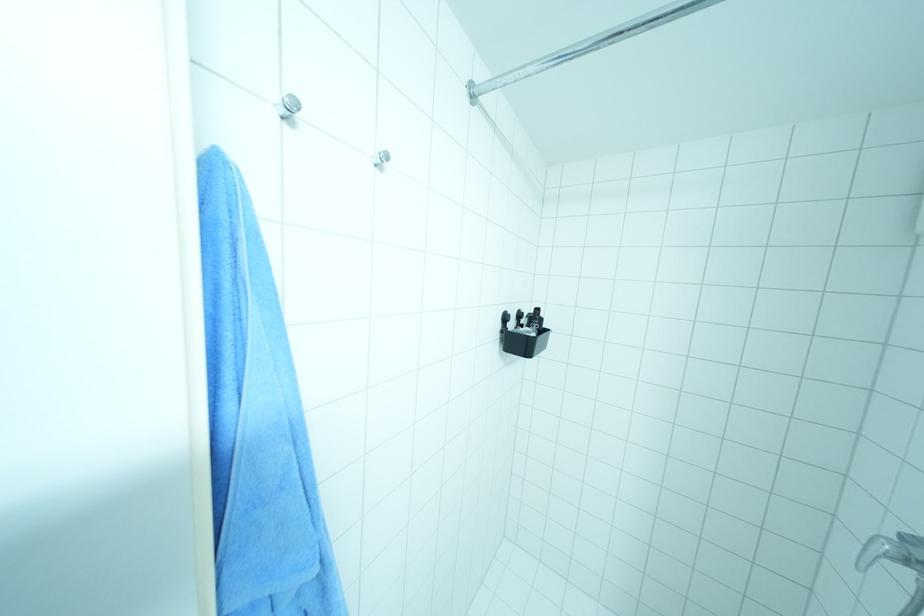
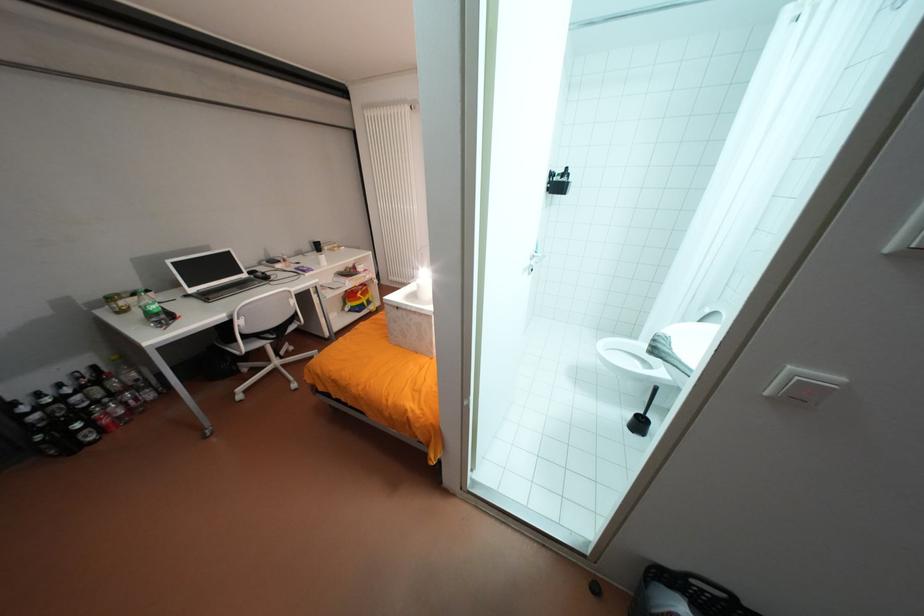
Where in the second image is the point corresponding to the point at 514,330 from the first image?

(558, 182)